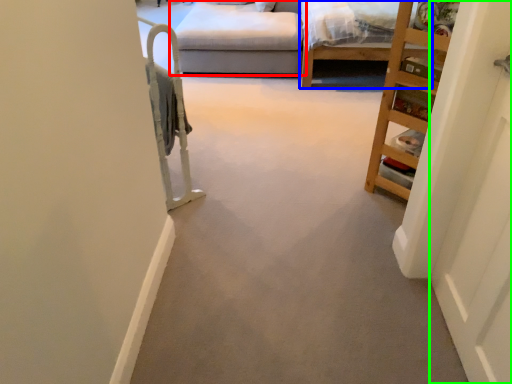
Question: Estimate the real-world distances between objects in this image. Which object is farther from studio couch (highlighted by a red box), bed frame (highlighted by a blue box) or door (highlighted by a green box)?

Choices:
 (A) bed frame
 (B) door

Answer: (B)